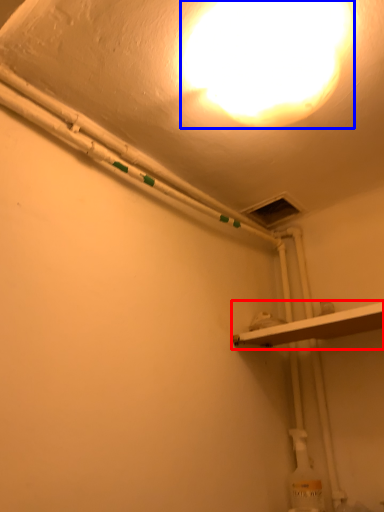
Question: Among these objects, which one is nearest to the camera, shelf (highlighted by a red box) or lamp (highlighted by a blue box)?

Choices:
 (A) shelf
 (B) lamp

Answer: (B)